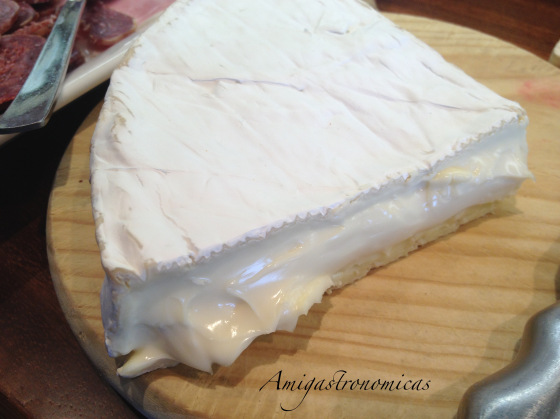
The width and height of the screenshot is (560, 419). I want to click on dim light, so click(513, 7).